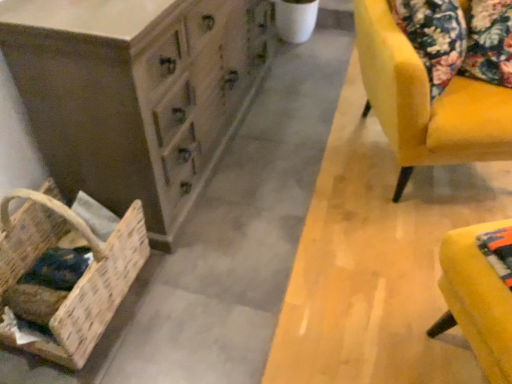
At what (x,y) coordinates should I click in order to perform the action: click on vacant space in between yellow fabric ottoman at lower right and wooden chest of drawers at lower left. Please return your answer as a coordinate pair (x, y). The image size is (512, 384). Looking at the image, I should click on (301, 220).